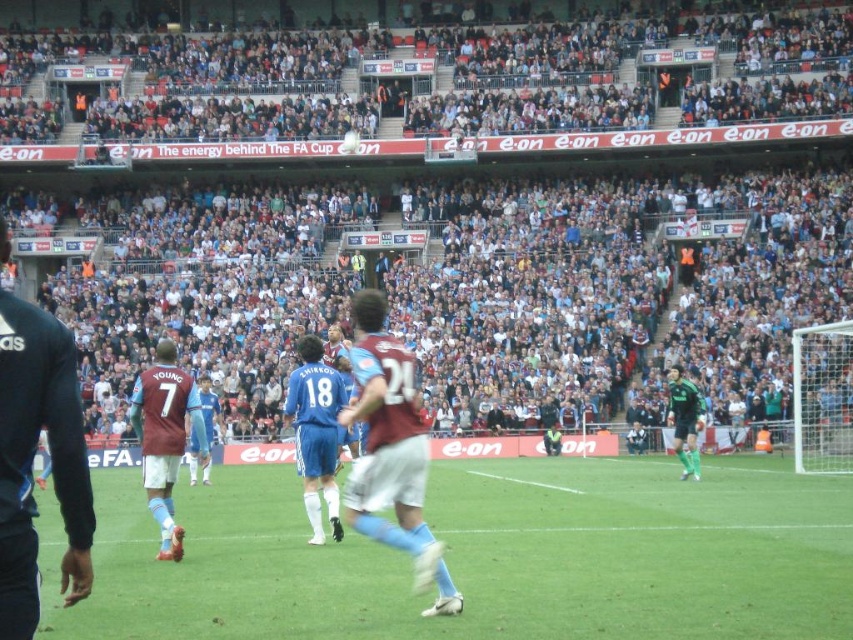
Question: Does white crowd at upper center appear on the left side of green matte jersey at right?

Choices:
 (A) yes
 (B) no

Answer: (A)

Question: Which object appears farthest from the camera in this image?

Choices:
 (A) white crowd at upper center
 (B) matte blue shorts at center
 (C) white matte shorts at center
 (D) blue jersey at center

Answer: (A)

Question: Is white crowd at upper center to the right of matte blue shorts at center from the viewer's perspective?

Choices:
 (A) no
 (B) yes

Answer: (B)

Question: Which of these objects is positioned farthest from the white matte shorts at center?

Choices:
 (A) green grass at center
 (B) white crowd at upper center

Answer: (B)

Question: Is white crowd at upper center thinner than green matte jersey at right?

Choices:
 (A) no
 (B) yes

Answer: (A)

Question: Which point appears farthest from the camera in this image?

Choices:
 (A) (117, 589)
 (B) (33, 560)

Answer: (A)